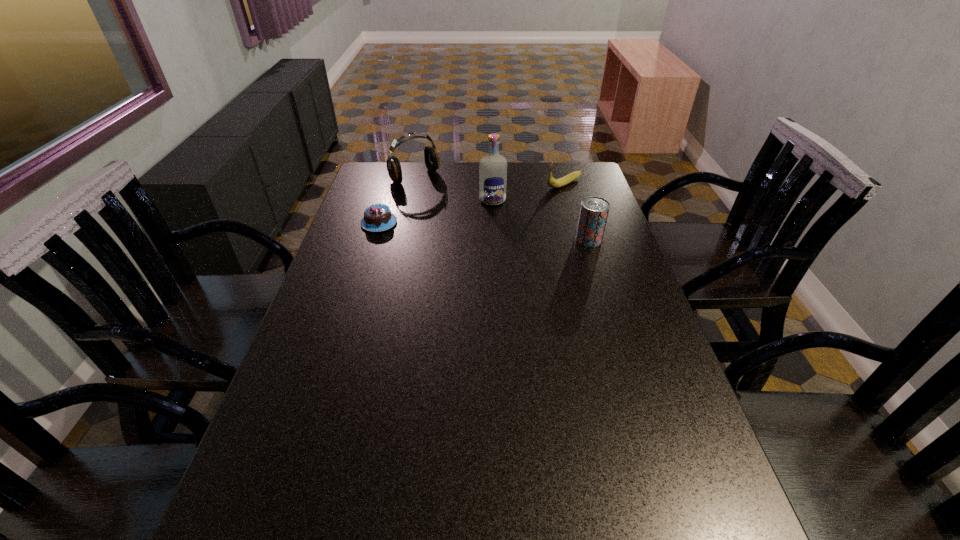
I want to click on vacant space at the near right corner of the desktop, so click(654, 474).

The height and width of the screenshot is (540, 960). In order to click on free point between the fourth shortest object and the beer can in this screenshot , I will do `click(502, 208)`.

Where is `free spot between the chocolate cake and the headset`? This screenshot has height=540, width=960. free spot between the chocolate cake and the headset is located at coordinates pyautogui.click(x=396, y=200).

Identify the location of free space between the third tallest object and the third farthest object. (540, 220).

Locate an element on the screen. The height and width of the screenshot is (540, 960). unoccupied position between the headset and the shortest object is located at coordinates (396, 200).

Image resolution: width=960 pixels, height=540 pixels. In order to click on free space between the fourth shortest object and the shortest object in this screenshot , I will do `click(396, 200)`.

In order to click on free space between the vodka and the beer can in this screenshot , I will do `click(540, 220)`.

Image resolution: width=960 pixels, height=540 pixels. What are the coordinates of `vacant space that's between the headset and the beer can` in the screenshot? It's located at (502, 208).

Locate an element on the screen. The height and width of the screenshot is (540, 960). vacant space in between the third tallest object and the second shortest object is located at coordinates (576, 212).

The width and height of the screenshot is (960, 540). Identify the location of vacant area that lies between the second tallest object and the beer can. (502, 208).